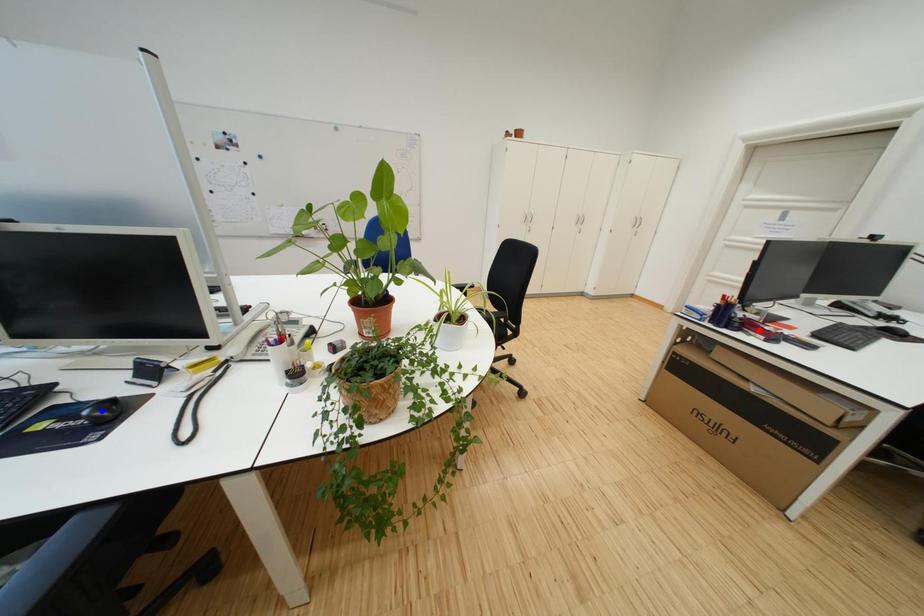
Question: Two points are marked on the image. Which point is closer to the camera?

Choices:
 (A) Blue point is closer.
 (B) Red point is closer.

Answer: (A)